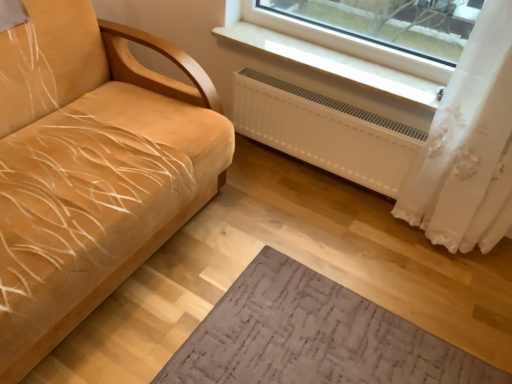
Locate an element on the screen. The height and width of the screenshot is (384, 512). free area below white matte radiator at lower center (from a real-world perspective) is located at coordinates (313, 169).